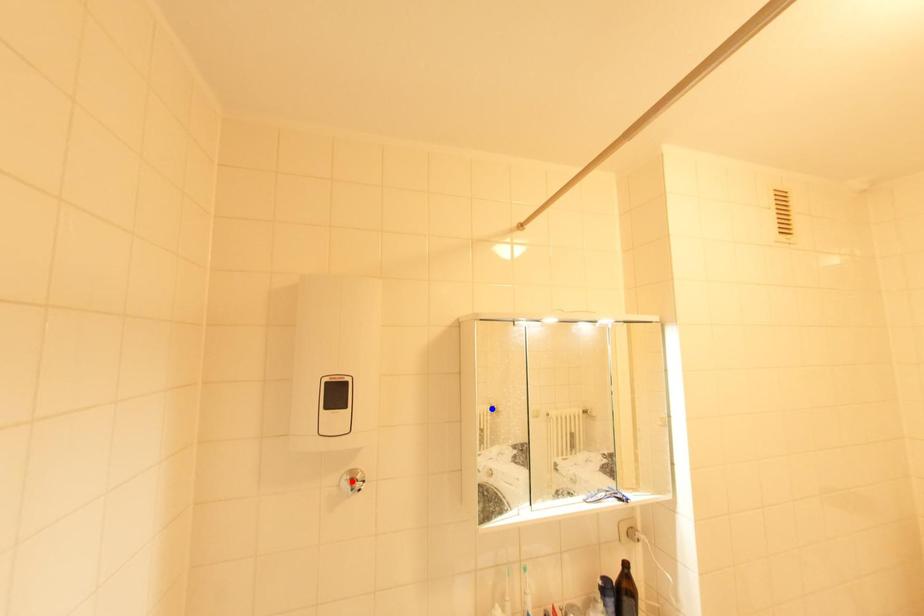
Question: Two points are marked on the image. Which point is closer to the camera?

Choices:
 (A) Blue point is closer.
 (B) Red point is closer.

Answer: (B)